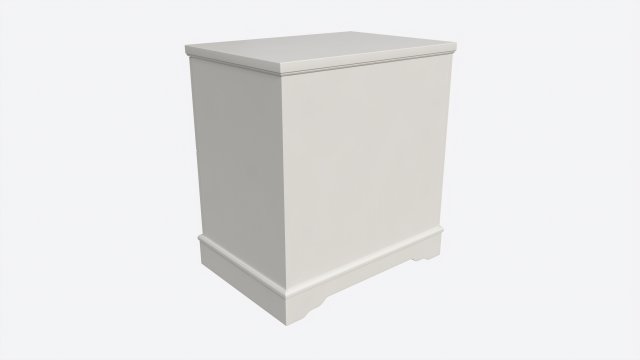
Locate an element on the screen. space underneath furniture is located at coordinates (355, 300).